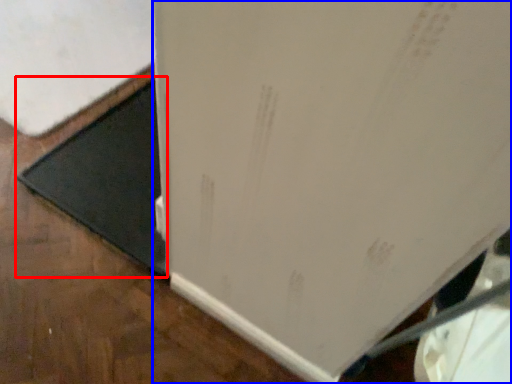
Question: Which point is closer to the camera, doormat (highlighted by a red box) or refrigerator (highlighted by a blue box)?

Choices:
 (A) doormat
 (B) refrigerator

Answer: (B)